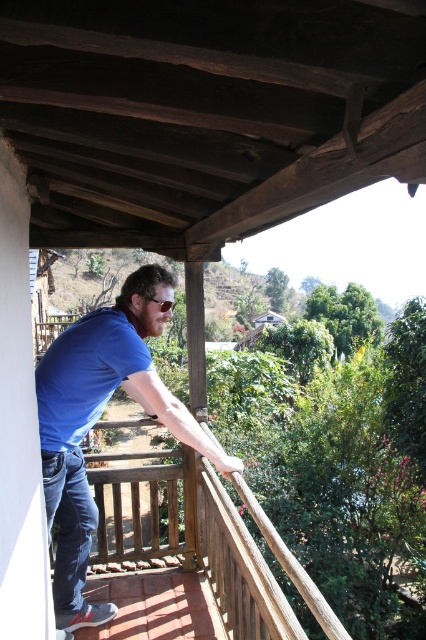
From the picture: You are a fashion designer observing a man wearing a blue cotton shirt at center and blue denim jeans at lower left. Which item of clothing is taller?

The blue cotton shirt at center is taller than the blue denim jeans at lower left.

You are a drone operator trying to capture a photo of the man on the balcony. To avoid obstruction, you need to position your drone so that it doesn not cross the wooden railing at upper center. According to the coordinates provided, what is the safest area to position the drone?

The wooden railing at upper center is located at coordinates point (199, 545). To avoid obstruction, position the drone slightly below or to the side of these coordinates, ensuring it stays clear of the wooden railing at upper center.